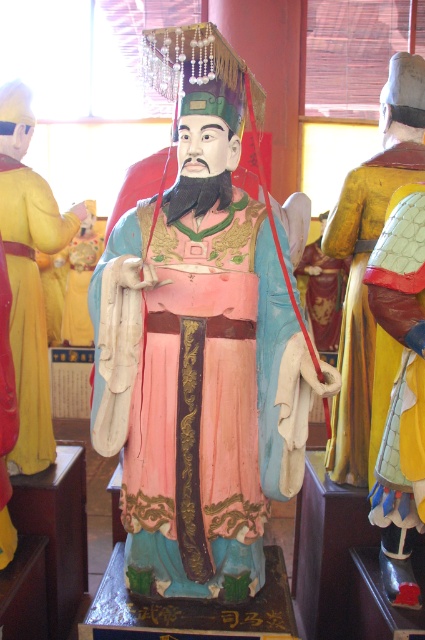
Can you confirm if matte painted statue at center is bigger than matte yellow robe at left?

Yes, matte painted statue at center is bigger than matte yellow robe at left.

Does matte painted statue at center appear on the right side of matte yellow robe at left?

Indeed, matte painted statue at center is positioned on the right side of matte yellow robe at left.

I want to click on matte painted statue at center, so click(201, 344).

Can you confirm if matte painted statue at center is smaller than yellow textured armor at right?

Actually, matte painted statue at center might be larger than yellow textured armor at right.

Can you confirm if matte painted statue at center is shorter than yellow textured armor at right?

No, matte painted statue at center is not shorter than yellow textured armor at right.

Who is more forward, (226, 353) or (333, 216)?

Point (226, 353)

The width and height of the screenshot is (425, 640). I want to click on matte painted statue at center, so click(201, 344).

Between yellow textured armor at right and matte yellow robe at left, which one has less height?

Standing shorter between the two is yellow textured armor at right.

Between point (340, 202) and point (31, 120), which one is positioned behind?

The point (31, 120) is behind.

Locate an element on the screen. This screenshot has width=425, height=640. yellow textured armor at right is located at coordinates coord(363,308).